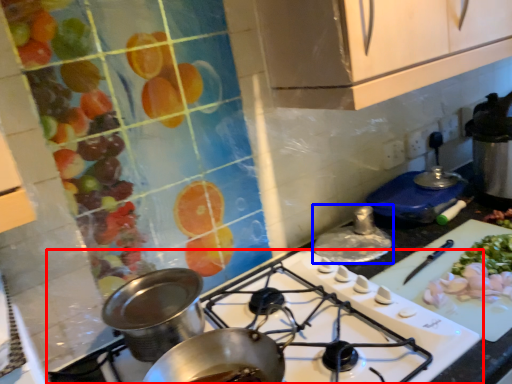
Question: Which object is further to the camera taking this photo, gas stove (highlighted by a red box) or kitchen appliance (highlighted by a blue box)?

Choices:
 (A) gas stove
 (B) kitchen appliance

Answer: (B)